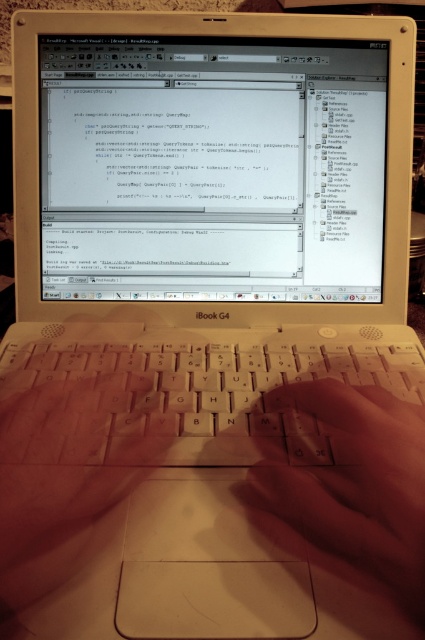
You are a photographer trying to capture a close up of the smooth skin hand at center without the matte black screen at center appearing in the shot. Based on the scene, can you position yourself in a way to achieve this?

The matte black screen at center is to the left of the smooth skin hand at center. Since the screen is positioned to the left of the hand, you can move your camera to the right side of the hand to avoid capturing the screen in the shot.

You are a photographer setting up a shot of the iBook G4 laptop. You need to ensure that both the matte black screen at center and the white plastic keyboard at center are clearly visible in the photo. Based on their positions, which object should you focus on first to ensure both are in focus?

The white plastic keyboard at center is behind matte black screen at center, so you should focus on the white plastic keyboard at center first to ensure both are in focus.

You are a graphic designer working on this laptop. You need to place a new icon at point A and point B. The points are labeled as point (x=350, y=336) and point (x=385, y=531). According to the laptop screen layout, which point is closer to the bottom edge of the screen?

Point (x=350, y=336) is closer to the bottom edge of the screen because it is behind point (x=385, y=531), meaning it is positioned lower on the screen.